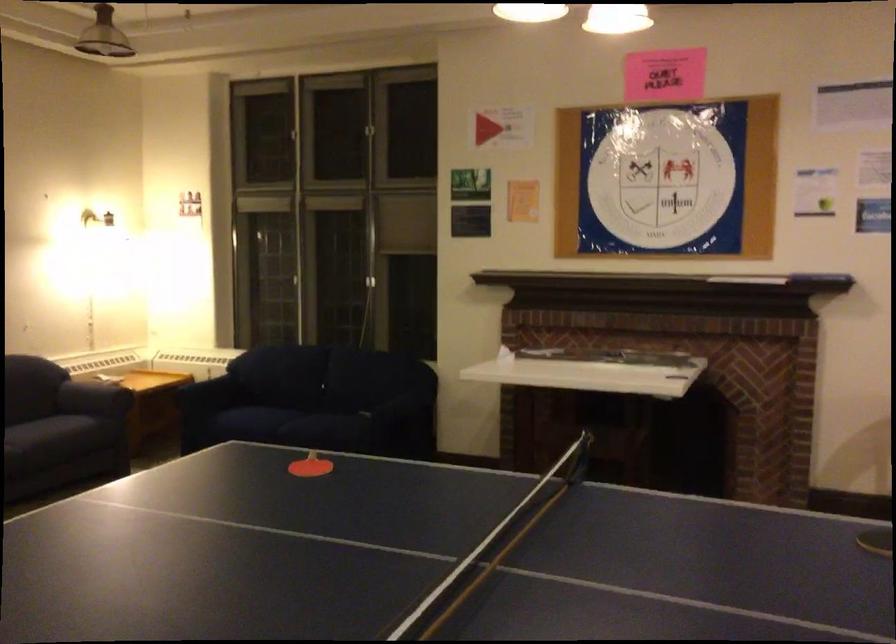
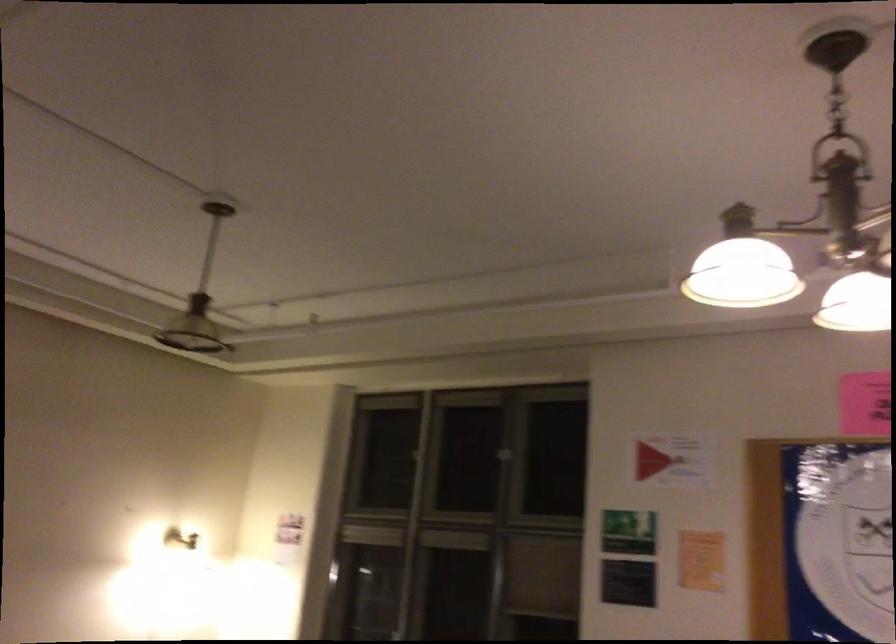
Question: The images are taken continuously from a first-person perspective. In which direction are you moving?

Choices:
 (A) Left
 (B) Right
 (C) Forward
 (D) Backward

Answer: (C)